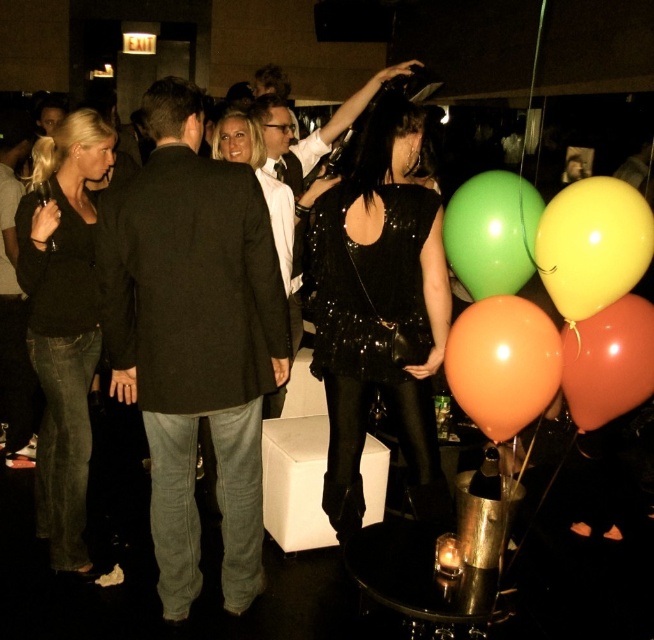
Is black sequined dress at center above matte black blazer at center?

No, black sequined dress at center is not above matte black blazer at center.

Does black sequined dress at center appear under matte black blazer at center?

Yes.

Locate an element on the screen. This screenshot has height=640, width=654. black sequined dress at center is located at coordinates (379, 301).

You are a GUI agent. You are given a task and a screenshot of the screen. Output one action in this format:
    pyautogui.click(x=<x>, y=<y>)
    Task: Click on the black sequined dress at center
    
    Given the screenshot: What is the action you would take?
    (379, 301)

Who is positioned more to the left, green glossy balloon at center or matte black blazer at center?

From the viewer's perspective, matte black blazer at center appears more on the left side.

Where is `green glossy balloon at center`? The height and width of the screenshot is (640, 654). green glossy balloon at center is located at coordinates click(490, 232).

This screenshot has width=654, height=640. In order to click on green glossy balloon at center in this screenshot , I will do `click(490, 232)`.

Is black sequined dress at center bigger than orange matte balloon at lower right?

Yes.

Which is above, black sequined dress at center or orange matte balloon at lower right?

Positioned higher is black sequined dress at center.

Where is `black sequined dress at center`? The width and height of the screenshot is (654, 640). black sequined dress at center is located at coordinates (379, 301).